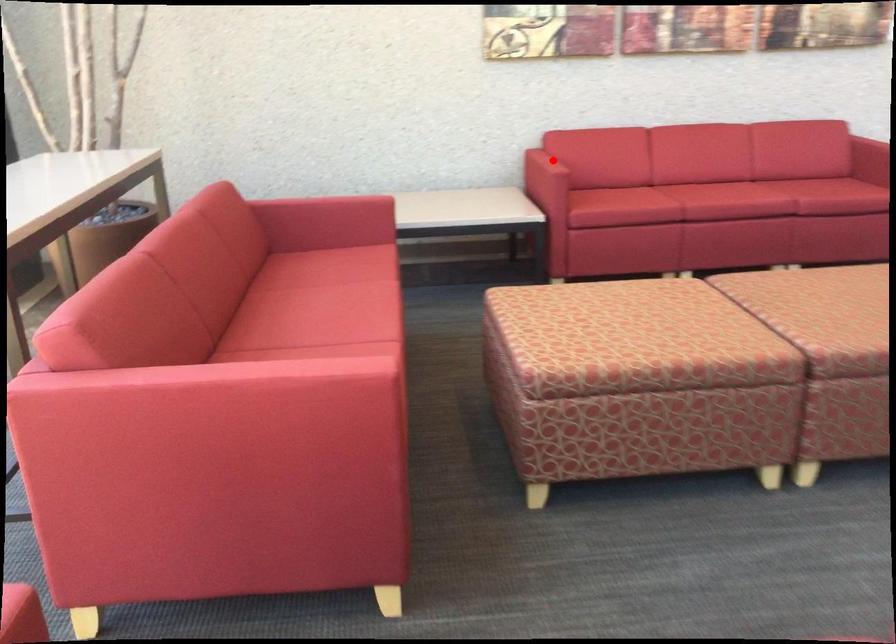
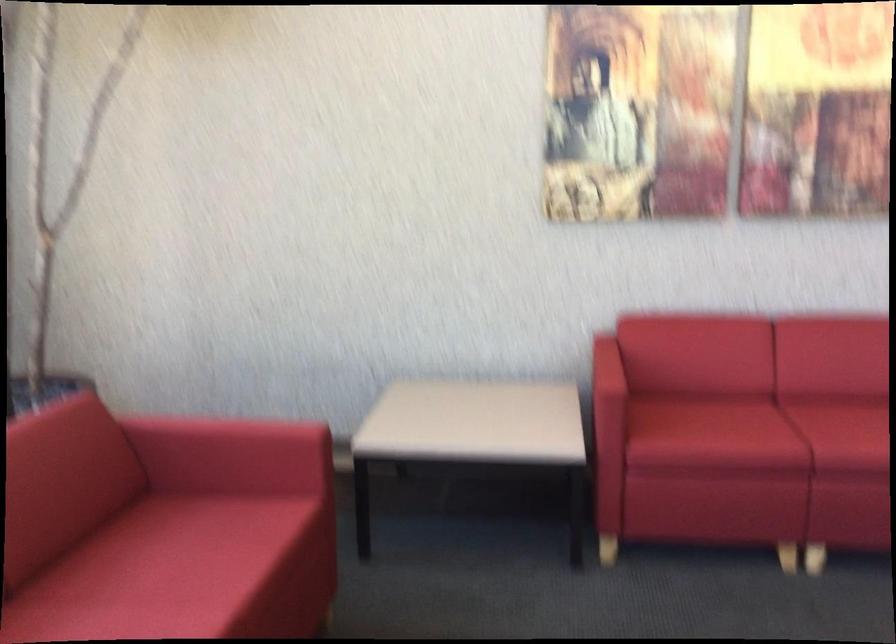
In the second image, find the point that corresponds to the highlighted location in the first image.

(607, 377)